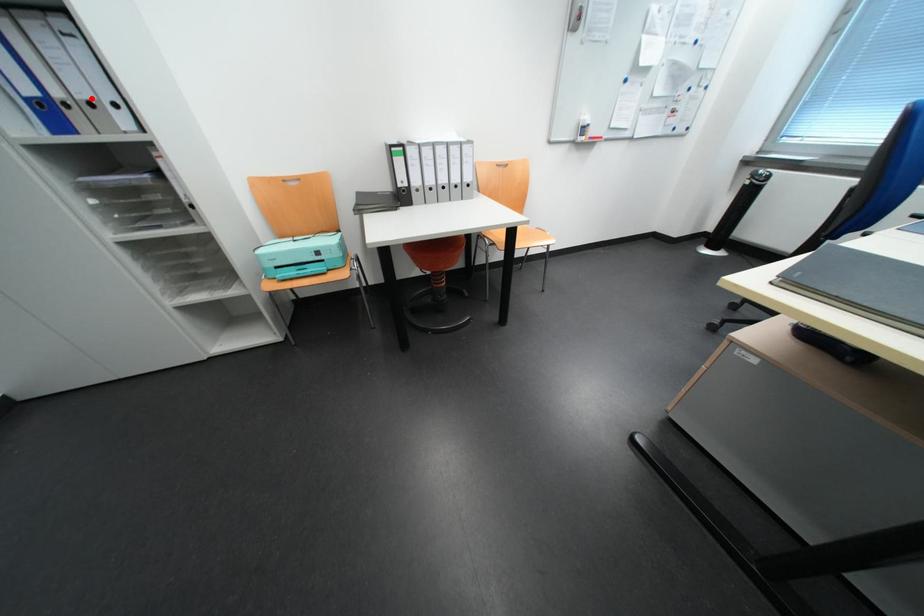
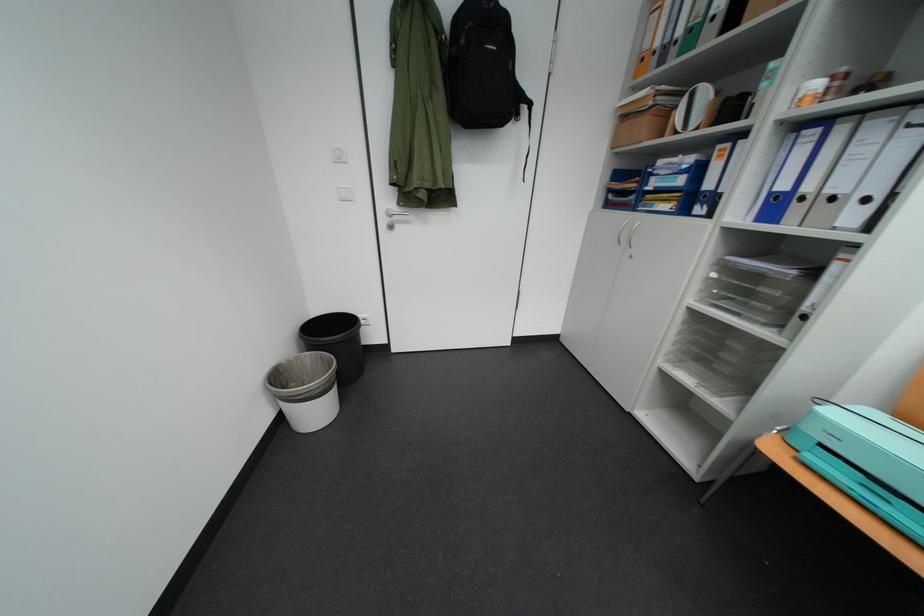
Where in the second image is the point corresponding to the highlighted location from the first image?

(841, 193)